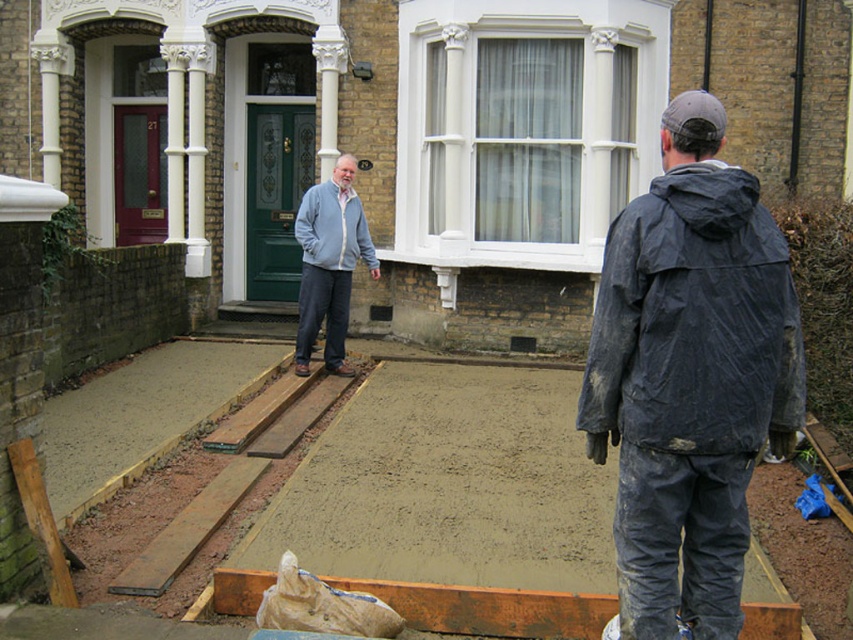
You are a construction worker standing at the bottom left corner of the image. You need to walk to the smooth concrete at center. Which direction should you move first?

You should move towards the center of the image first to reach the smooth concrete at center.